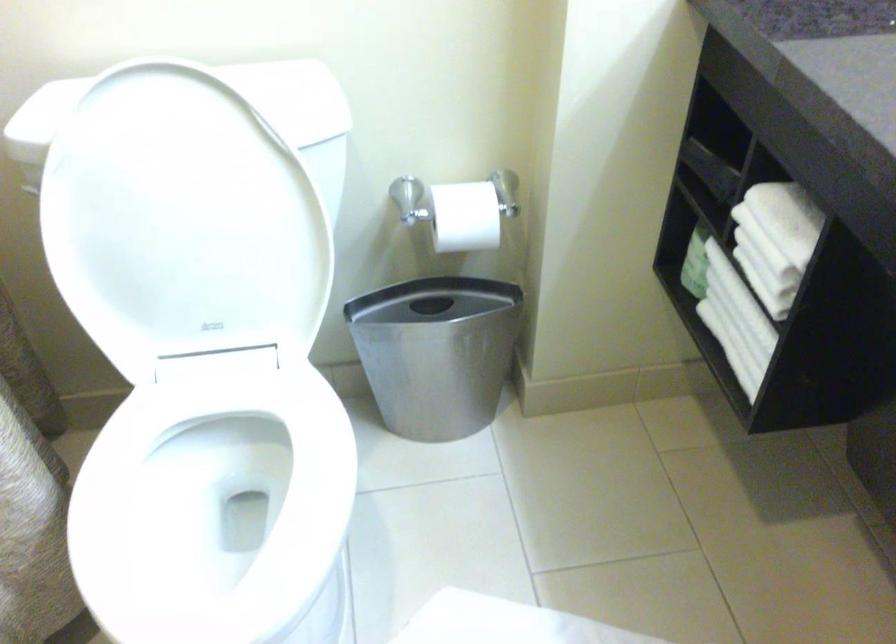
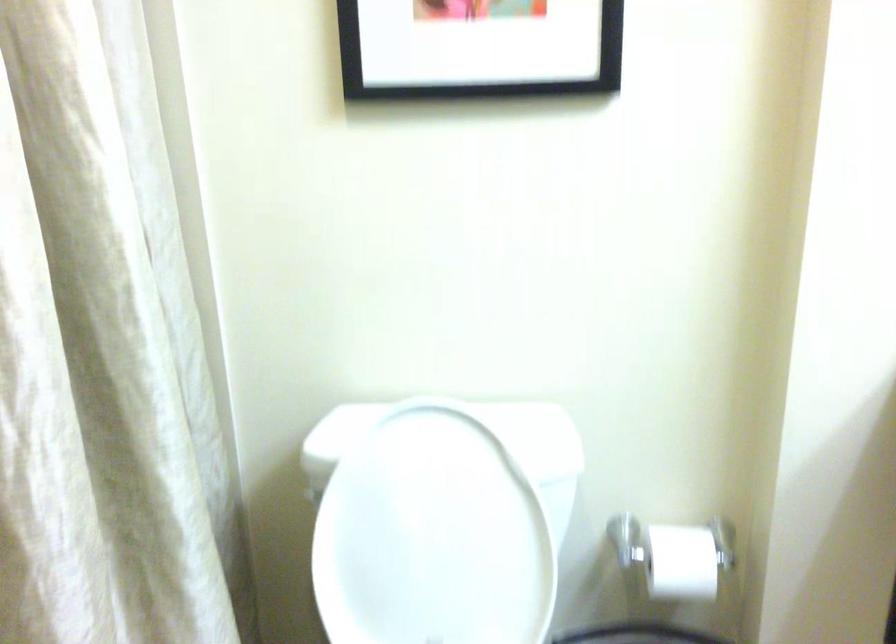
The point at (199, 198) is marked in the first image. Where is the corresponding point in the second image?

(440, 520)